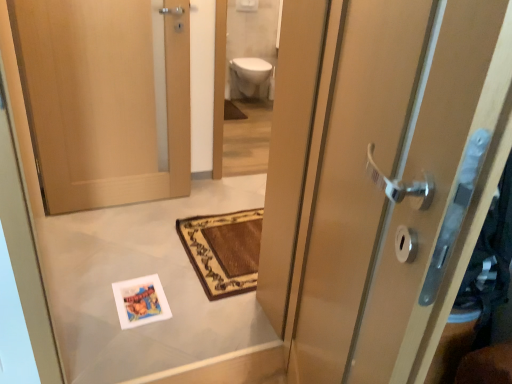
Question: Considering the relative sizes of white glossy toilet at upper center and white glossy toilet bowl at upper center in the image provided, is white glossy toilet at upper center thinner than white glossy toilet bowl at upper center?

Choices:
 (A) yes
 (B) no

Answer: (A)

Question: Can you confirm if white glossy toilet at upper center is bigger than white glossy toilet bowl at upper center?

Choices:
 (A) no
 (B) yes

Answer: (B)

Question: From a real-world perspective, is white glossy toilet at upper center physically above white glossy toilet bowl at upper center?

Choices:
 (A) no
 (B) yes

Answer: (B)

Question: Does white glossy toilet at upper center have a lesser height compared to white glossy toilet bowl at upper center?

Choices:
 (A) yes
 (B) no

Answer: (B)

Question: Is white glossy toilet bowl at upper center located within white glossy toilet at upper center?

Choices:
 (A) yes
 (B) no

Answer: (B)

Question: Is point (336, 235) positioned closer to the camera than point (253, 72)?

Choices:
 (A) farther
 (B) closer

Answer: (B)

Question: From the image's perspective, is matte wood door at right, the first door from the right, located above or below white glossy toilet bowl at upper center?

Choices:
 (A) above
 (B) below

Answer: (B)

Question: From a real-world perspective, is matte wood door at right, the first door from the right, positioned above or below white glossy toilet bowl at upper center?

Choices:
 (A) below
 (B) above

Answer: (B)

Question: Based on their sizes in the image, would you say matte wood door at right, the first door from the right, is bigger or smaller than white glossy toilet bowl at upper center?

Choices:
 (A) big
 (B) small

Answer: (A)

Question: Do you think brown woven bath mat at center is within matte wood door at right, the 2th door when ordered from left to right, or outside of it?

Choices:
 (A) outside
 (B) inside

Answer: (A)

Question: Considering their positions, is brown woven bath mat at center located in front of or behind matte wood door at right, the first door from the right?

Choices:
 (A) front
 (B) behind

Answer: (B)

Question: Is point click(x=224, y=107) closer or farther from the camera than point click(x=331, y=380)?

Choices:
 (A) closer
 (B) farther

Answer: (B)

Question: Would you say brown woven bath mat at center is to the left or to the right of matte wood door at right, the 1th door when ordered from front to back, in the picture?

Choices:
 (A) left
 (B) right

Answer: (A)

Question: From a real-world perspective, is brown woven bath mat at center above or below wooden door at left, which is the 2th door from right to left?

Choices:
 (A) below
 (B) above

Answer: (A)

Question: In the image, is brown woven bath mat at center positioned in front of or behind wooden door at left, arranged as the 2th door when viewed from the front?

Choices:
 (A) front
 (B) behind

Answer: (B)